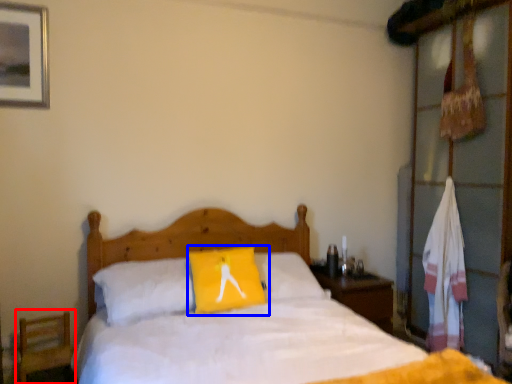
Question: Which object is further to the camera taking this photo, armchair (highlighted by a red box) or pillow (highlighted by a blue box)?

Choices:
 (A) armchair
 (B) pillow

Answer: (B)